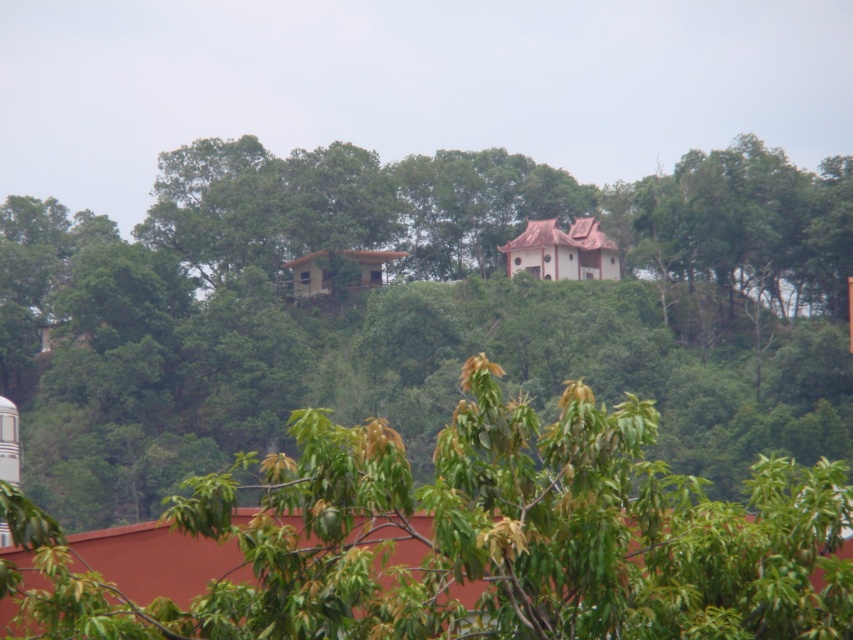
You are standing on the hilltop and want to take a photo of both the red roofed structure and the two traditional buildings with reddish brown roofs. You notice two points marked on your camera screen at coordinates point (99, 388) and point (549, 620). Which point should you focus on to ensure both structures are in focus?

You should focus on point (99, 388) because it is closer to the viewer than point (549, 620), allowing both the foreground red roofed structure and the middle ground traditional buildings to be in focus.

You are standing on the hilltop and want to take a photo of both the green leafy tree at upper center and the green leafy tree at center. Which tree should you adjust your camera angle to include first if you want to capture both in the frame?

The green leafy tree at upper center is located above the green leafy tree at center, so you should adjust your camera angle to include the upper tree first to ensure both are in the frame.